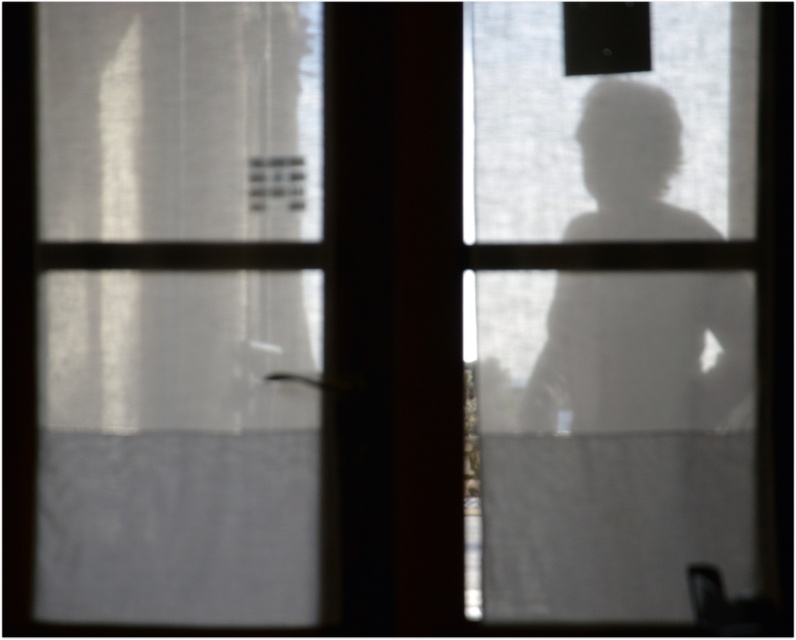
You are a photographer trying to capture the silhouette of the person in the scene. You notice the satin white curtain at left and the transparent glass figure at right. Which object is closer to the left edge of the window?

The satin white curtain at left is positioned on the left side of the transparent glass figure at right, so it is closer to the left edge of the window.

You are trying to decide whether to place a decorative item on the satin white curtain at left or the transparent glass figure at right. Based on their widths, which surface can accommodate a wider object?

The transparent glass figure at right has a greater width than the satin white curtain at left, so it can accommodate a wider object.

You are a photographer trying to capture the silhouette of the transparent glass figure at right without the satin white curtain at left appearing in the foreground. Is this possible given their positions?

The satin white curtain at left is further to the viewer than the transparent glass figure at right, so the curtain would block the view of the glass figure. Therefore, it is not possible to capture the glass figure without the curtain appearing in front of it.